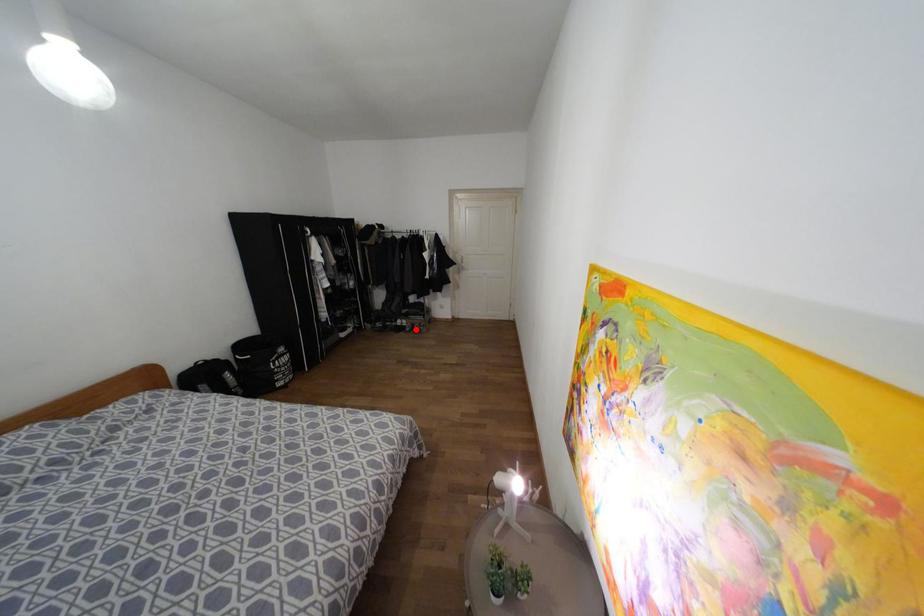
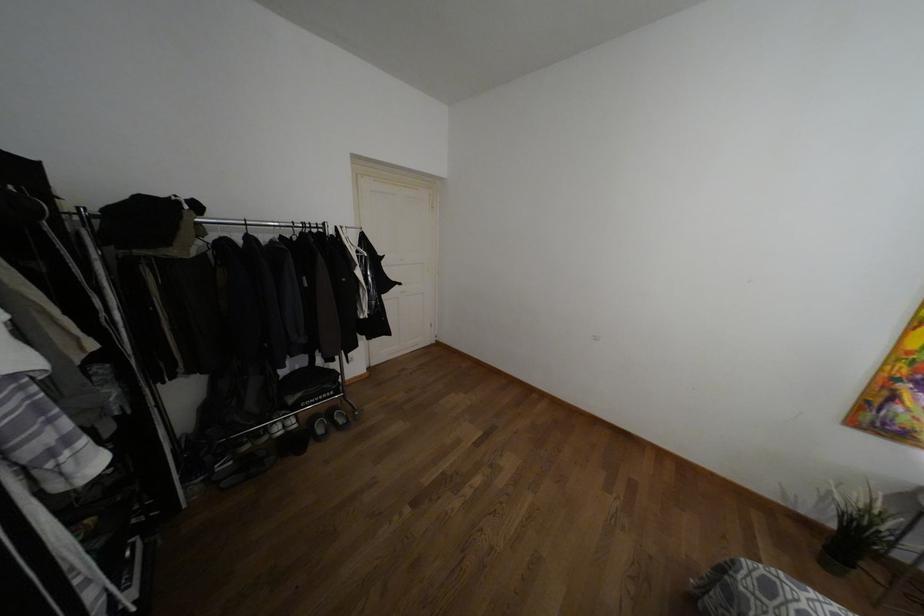
In the second image, find the point that corresponds to the highlighted location in the first image.

(341, 419)